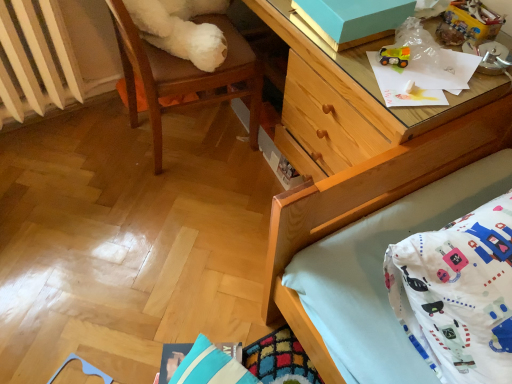
Question: Does blue striped pillow at lower center have a greater width compared to white cotton pillow at lower right?

Choices:
 (A) yes
 (B) no

Answer: (B)

Question: Considering the relative sizes of blue striped pillow at lower center and white cotton pillow at lower right in the image provided, is blue striped pillow at lower center thinner than white cotton pillow at lower right?

Choices:
 (A) no
 (B) yes

Answer: (B)

Question: From the image's perspective, is blue striped pillow at lower center above white cotton pillow at lower right?

Choices:
 (A) no
 (B) yes

Answer: (A)

Question: Is blue striped pillow at lower center positioned in front of white cotton pillow at lower right?

Choices:
 (A) no
 (B) yes

Answer: (A)

Question: From a real-world perspective, is blue striped pillow at lower center on top of white cotton pillow at lower right?

Choices:
 (A) no
 (B) yes

Answer: (A)

Question: Is blue striped pillow at lower center bigger than white cotton pillow at lower right?

Choices:
 (A) yes
 (B) no

Answer: (B)

Question: Considering the relative sizes of rubberized yellow toy truck at upper right, the first toy positioned from the left, and white plastic radiator at left in the image provided, is rubberized yellow toy truck at upper right, the first toy positioned from the left, taller than white plastic radiator at left?

Choices:
 (A) no
 (B) yes

Answer: (A)

Question: Does rubberized yellow toy truck at upper right, the first toy positioned from the left, have a greater width compared to white plastic radiator at left?

Choices:
 (A) no
 (B) yes

Answer: (A)

Question: Is rubberized yellow toy truck at upper right, acting as the 2th toy starting from the top, oriented towards white plastic radiator at left?

Choices:
 (A) yes
 (B) no

Answer: (A)

Question: Is rubberized yellow toy truck at upper right, the 1th toy from the bottom, bigger than white plastic radiator at left?

Choices:
 (A) no
 (B) yes

Answer: (A)

Question: Considering the relative sizes of rubberized yellow toy truck at upper right, the second toy in the right-to-left sequence, and white plastic radiator at left in the image provided, is rubberized yellow toy truck at upper right, the second toy in the right-to-left sequence, smaller than white plastic radiator at left?

Choices:
 (A) yes
 (B) no

Answer: (A)

Question: Is rubberized yellow toy truck at upper right, the second toy in the right-to-left sequence, looking in the opposite direction of white plastic radiator at left?

Choices:
 (A) no
 (B) yes

Answer: (A)

Question: Could you tell me if plastic toy car at upper right, acting as the second toy starting from the bottom, is turned towards rubberized yellow toy truck at upper right, the 1th toy from the bottom?

Choices:
 (A) no
 (B) yes

Answer: (B)